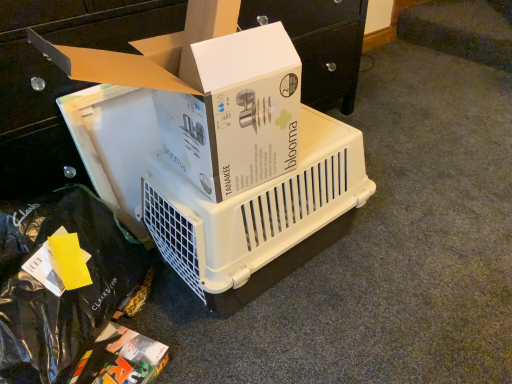
Question: From the image's perspective, is white plastic pet carrier at center over multicolored cardboard box at lower left, the third box positioned from the top?

Choices:
 (A) no
 (B) yes

Answer: (B)

Question: Can you confirm if white plastic pet carrier at center is thinner than multicolored cardboard box at lower left, placed as the first box when sorted from bottom to top?

Choices:
 (A) no
 (B) yes

Answer: (A)

Question: Does white plastic pet carrier at center come in front of multicolored cardboard box at lower left, placed as the first box when sorted from bottom to top?

Choices:
 (A) no
 (B) yes

Answer: (A)

Question: Does white plastic pet carrier at center have a larger size compared to multicolored cardboard box at lower left, placed as the first box when sorted from bottom to top?

Choices:
 (A) no
 (B) yes

Answer: (B)

Question: Does white plastic pet carrier at center have a greater width compared to multicolored cardboard box at lower left, placed as the first box when sorted from bottom to top?

Choices:
 (A) yes
 (B) no

Answer: (A)

Question: In terms of width, does white cardboard box at upper center, positioned as the third box in bottom-to-top order, look wider or thinner when compared to white plastic pet carrier at center?

Choices:
 (A) thin
 (B) wide

Answer: (A)

Question: From the image's perspective, relative to white plastic pet carrier at center, is white cardboard box at upper center, the 1th box positioned from the top, above or below?

Choices:
 (A) below
 (B) above

Answer: (B)

Question: Considering the positions of white cardboard box at upper center, positioned as the third box in bottom-to-top order, and white plastic pet carrier at center in the image, is white cardboard box at upper center, positioned as the third box in bottom-to-top order, bigger or smaller than white plastic pet carrier at center?

Choices:
 (A) small
 (B) big

Answer: (A)

Question: Is white cardboard box at upper center, positioned as the third box in bottom-to-top order, taller or shorter than white plastic pet carrier at center?

Choices:
 (A) short
 (B) tall

Answer: (A)

Question: From a real-world perspective, is white cardboard box at upper center, positioned as the third box in bottom-to-top order, above or below multicolored cardboard box at lower left, placed as the first box when sorted from bottom to top?

Choices:
 (A) below
 (B) above

Answer: (B)

Question: Would you say white cardboard box at upper center, positioned as the third box in bottom-to-top order, is inside or outside multicolored cardboard box at lower left, the third box positioned from the top?

Choices:
 (A) inside
 (B) outside

Answer: (B)

Question: Is white cardboard box at upper center, positioned as the third box in bottom-to-top order, bigger or smaller than multicolored cardboard box at lower left, the third box positioned from the top?

Choices:
 (A) small
 (B) big

Answer: (B)

Question: From their relative heights in the image, would you say white cardboard box at upper center, the 1th box positioned from the top, is taller or shorter than multicolored cardboard box at lower left, the third box positioned from the top?

Choices:
 (A) short
 (B) tall

Answer: (B)

Question: Based on their positions, is white cardboard box at upper center, the 1th box positioned from the top, located to the left or right of white plastic crate at center, the 2th box in the top-to-bottom sequence?

Choices:
 (A) right
 (B) left

Answer: (A)

Question: Is white cardboard box at upper center, positioned as the third box in bottom-to-top order, wider or thinner than white plastic crate at center, acting as the 2th box starting from the bottom?

Choices:
 (A) wide
 (B) thin

Answer: (B)